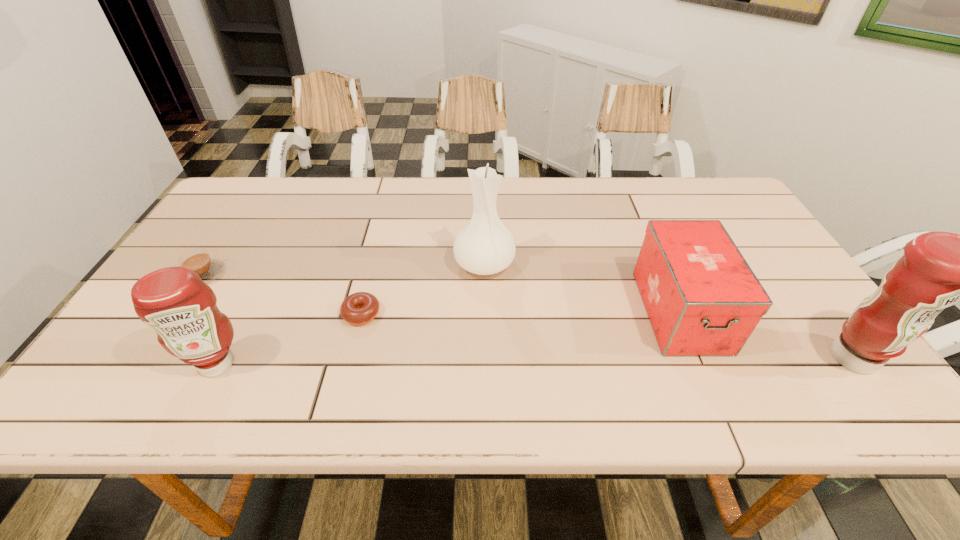
Identify the location of the fifth object from right to left. This screenshot has height=540, width=960. (181, 308).

The width and height of the screenshot is (960, 540). In order to click on the left condiment in this screenshot , I will do `click(181, 308)`.

You are a GUI agent. You are given a task and a screenshot of the screen. Output one action in this format:
    pyautogui.click(x=<x>, y=<y>)
    Task: Click on the taller condiment
    The image size is (960, 540).
    Given the screenshot: What is the action you would take?
    pyautogui.click(x=938, y=269)

At what (x,y) coordinates should I click in order to perform the action: click on the right condiment. Please return your answer as a coordinate pair (x, y). Looking at the image, I should click on (938, 269).

Locate an element on the screen. The width and height of the screenshot is (960, 540). vase is located at coordinates (485, 246).

The height and width of the screenshot is (540, 960). Find the location of `the second object from right to left`. the second object from right to left is located at coordinates coord(702,298).

The image size is (960, 540). I want to click on the first-aid kit, so click(702, 298).

Find the location of `the fourth object from right to left`. the fourth object from right to left is located at coordinates (359, 308).

Image resolution: width=960 pixels, height=540 pixels. Identify the location of the shortest object. (359, 308).

Image resolution: width=960 pixels, height=540 pixels. Identify the location of cappuccino. (198, 260).